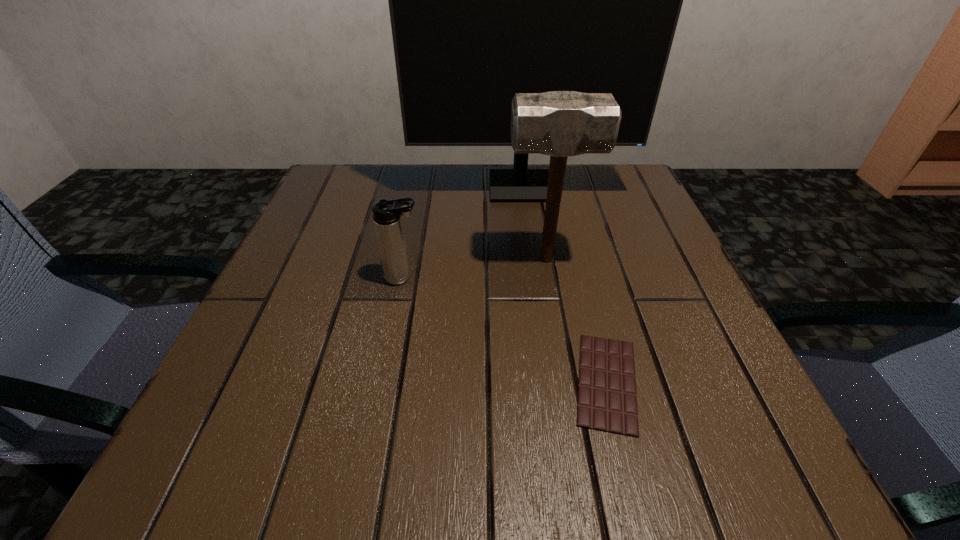
Locate an element on the screen. The width and height of the screenshot is (960, 540). free space located 0.170m on the handle side of the thermos bottle is located at coordinates tap(515, 278).

Locate an element on the screen. free space located 0.270m on the left of the shortest object is located at coordinates (385, 382).

Where is `object located in the far edge section of the desktop`? Image resolution: width=960 pixels, height=540 pixels. object located in the far edge section of the desktop is located at coordinates [486, 0].

Identify the location of object present at the near edge. (607, 400).

I want to click on computer monitor that is positioned at the right edge, so click(x=486, y=0).

This screenshot has width=960, height=540. I want to click on chocolate bar that is at the right edge, so click(607, 400).

Locate an element on the screen. This screenshot has height=540, width=960. object located in the far right corner section of the desktop is located at coordinates (486, 0).

Image resolution: width=960 pixels, height=540 pixels. What are the coordinates of `object situated at the near right corner` in the screenshot? It's located at (607, 400).

In the image, there is a desktop. Where is `vacant space at the far edge`? The height and width of the screenshot is (540, 960). vacant space at the far edge is located at coordinates (394, 179).

In order to click on vacant point at the near edge in this screenshot , I will do `click(334, 425)`.